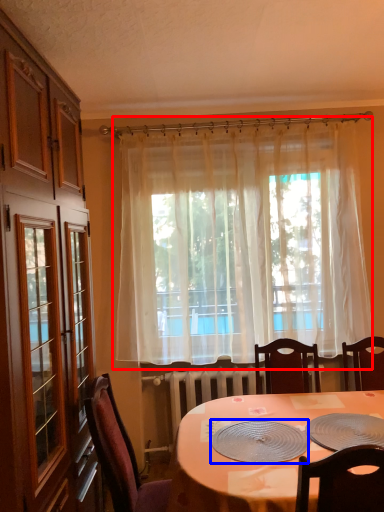
Question: Which point is closer to the camera, curtain (highlighted by a red box) or platter (highlighted by a blue box)?

Choices:
 (A) curtain
 (B) platter

Answer: (B)